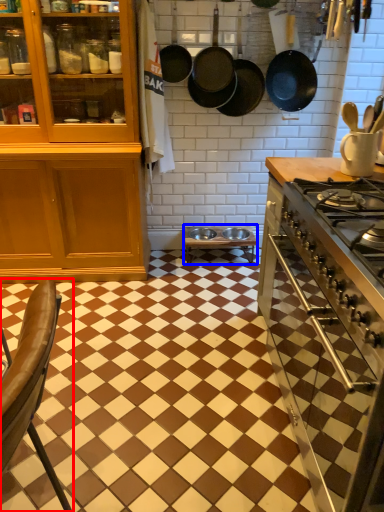
Question: Which of the following is the farthest to the observer, chair (highlighted by a red box) or table (highlighted by a blue box)?

Choices:
 (A) chair
 (B) table

Answer: (B)